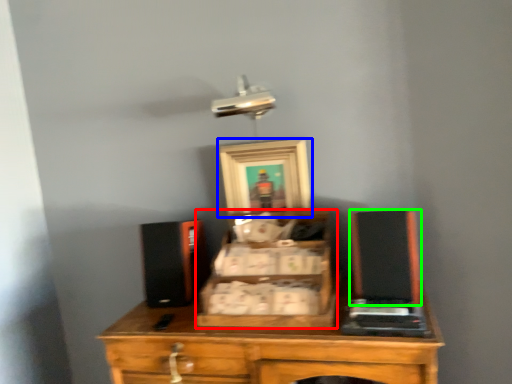
Question: Considering the real-world distances, which object is farthest from drawer (highlighted by a red box)? picture frame (highlighted by a blue box) or wide (highlighted by a green box)?

Choices:
 (A) picture frame
 (B) wide

Answer: (A)